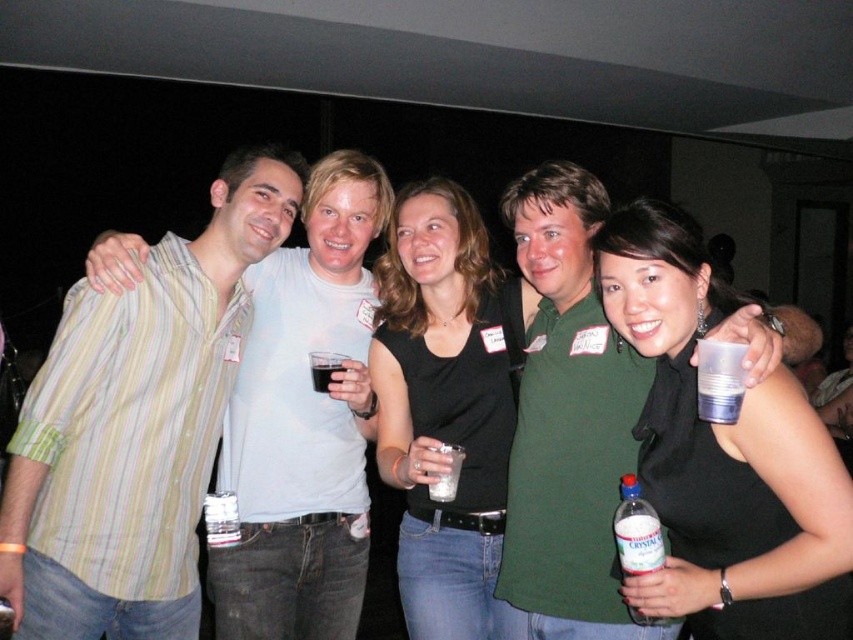
You are standing in the center of the room and want to move towards the point marked at coordinates (445,403). What object or clothing item is located at that point?

The point at coordinates (445,403) is on the black matte shirt at center.

You are organizing a clothing donation drive and need to categorize the black matte tank top at center and the striped cotton shirt at left based on their sizes. Which clothing item is smaller?

The black matte tank top at center has a smaller size compared to striped cotton shirt at left, so the black matte tank top at center is the smaller one.

You are a photographer adjusting the lighting in the room. You need to ensure that both the black matte tank top at center and the striped cotton shirt at left are well lit. Which clothing item should you focus your light on first to ensure it is visible, considering their positions?

The black matte tank top at center should be focused on first because it is positioned over the striped cotton shirt at left, meaning it is closer to the camera and requires proper lighting to avoid overshadowing the shirt behind it.